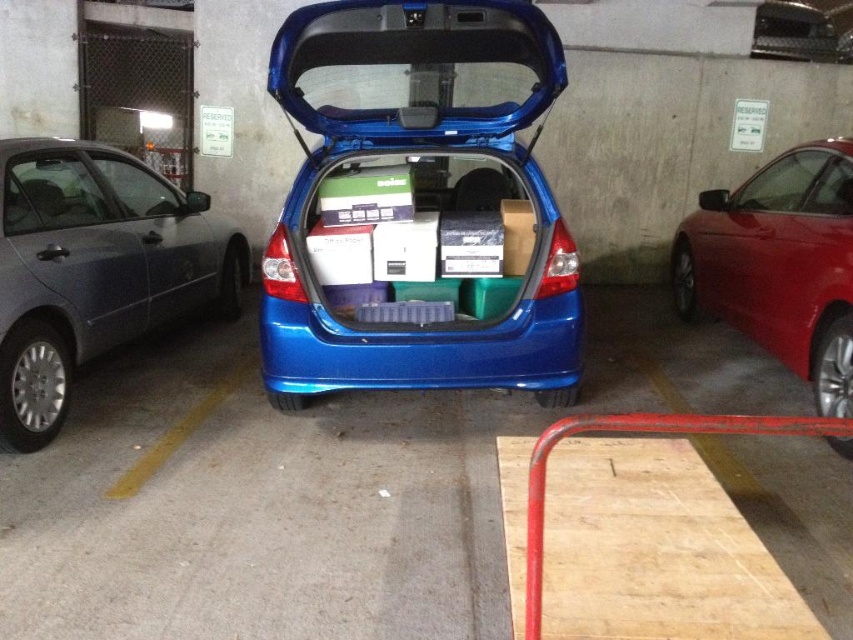
You are trying to park your car in the parking garage. You see the matte gray sedan at left and the shiny red sedan at right. Which car is larger in size?

The matte gray sedan at left is bigger than the shiny red sedan at right.

You are standing at the point labeled as point (419, 205) in the parking garage. What object are you directly facing?

The point labeled as point (419, 205) directly faces the blue glossy hatchback at center.